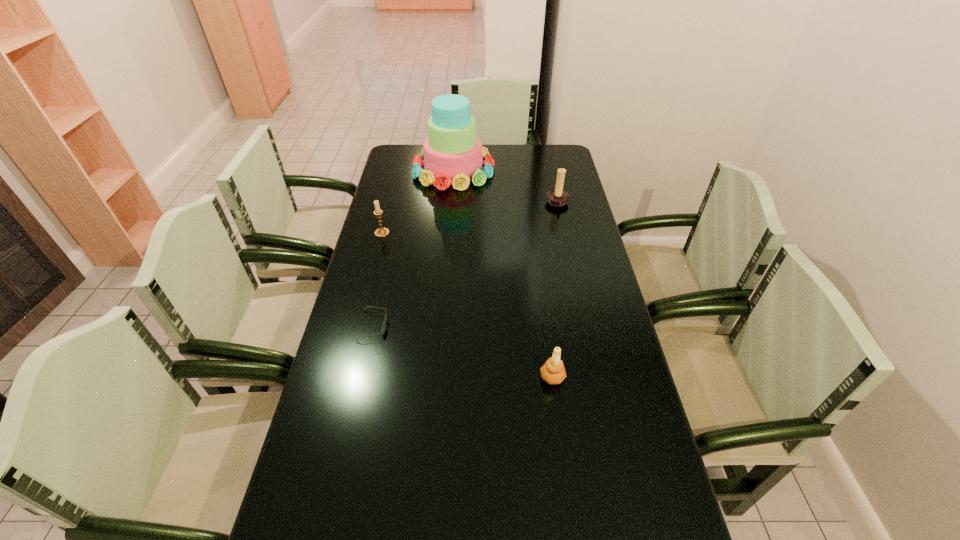
Identify the location of vacant area situated 0.210m on the right of the tallest object. The height and width of the screenshot is (540, 960). (543, 170).

Locate an element on the screen. Image resolution: width=960 pixels, height=540 pixels. vacant space located 0.360m on the wick of the farthest candle_holder is located at coordinates (453, 204).

Where is `vacant space located on the wick of the farthest candle_holder`? This screenshot has width=960, height=540. vacant space located on the wick of the farthest candle_holder is located at coordinates (482, 204).

In order to click on vacant space situated 0.110m on the wick of the farthest candle_holder in this screenshot , I will do `click(517, 204)`.

Where is `blank area located on the back of the second farthest candle_holder`? blank area located on the back of the second farthest candle_holder is located at coordinates click(395, 184).

Locate an element on the screen. The image size is (960, 540). vacant space positioned on the back of the nearest object is located at coordinates (539, 279).

You are a GUI agent. You are given a task and a screenshot of the screen. Output one action in this format:
    pyautogui.click(x=<x>, y=<y>)
    Task: Click on the vacant point located 0.150m on the lenses of the shortest object
    The height and width of the screenshot is (540, 960).
    Given the screenshot: What is the action you would take?
    pyautogui.click(x=439, y=326)

Locate an element on the screen. Image resolution: width=960 pixels, height=540 pixels. object situated at the far edge is located at coordinates (452, 153).

I want to click on cake located at the left edge, so click(x=452, y=153).

The image size is (960, 540). In order to click on candle holder that is at the left edge in this screenshot , I will do `click(381, 232)`.